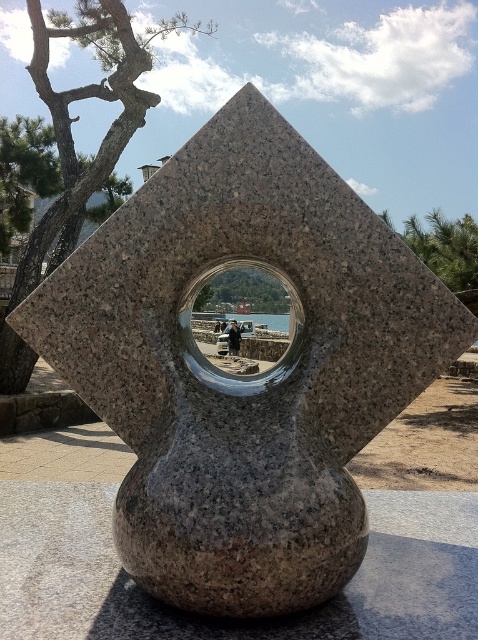
Question: Which point is closer to the camera?

Choices:
 (A) (256, 324)
 (B) (256, 259)
 (C) (445, 253)

Answer: (B)

Question: Does green textured bark at upper left appear under green leafy tree at center?

Choices:
 (A) no
 (B) yes

Answer: (A)

Question: Among these points, which one is nearest to the camera?

Choices:
 (A) (234, 339)
 (B) (259, 324)

Answer: (A)

Question: Can you confirm if transparent glass hole at center is positioned above transparent glass water at center?

Choices:
 (A) no
 (B) yes

Answer: (A)

Question: Does green textured tree at upper right appear under transparent glass water at center?

Choices:
 (A) yes
 (B) no

Answer: (B)

Question: Which object is positioned closest to the green textured tree at upper right?

Choices:
 (A) green textured tree at upper left
 (B) green leafy tree at center

Answer: (B)